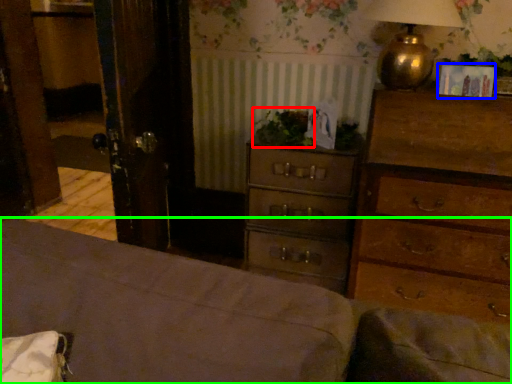
Question: Considering the real-world distances, which object is farthest from plant (highlighted by a red box)? picture frame (highlighted by a blue box) or bed frame (highlighted by a green box)?

Choices:
 (A) picture frame
 (B) bed frame

Answer: (B)